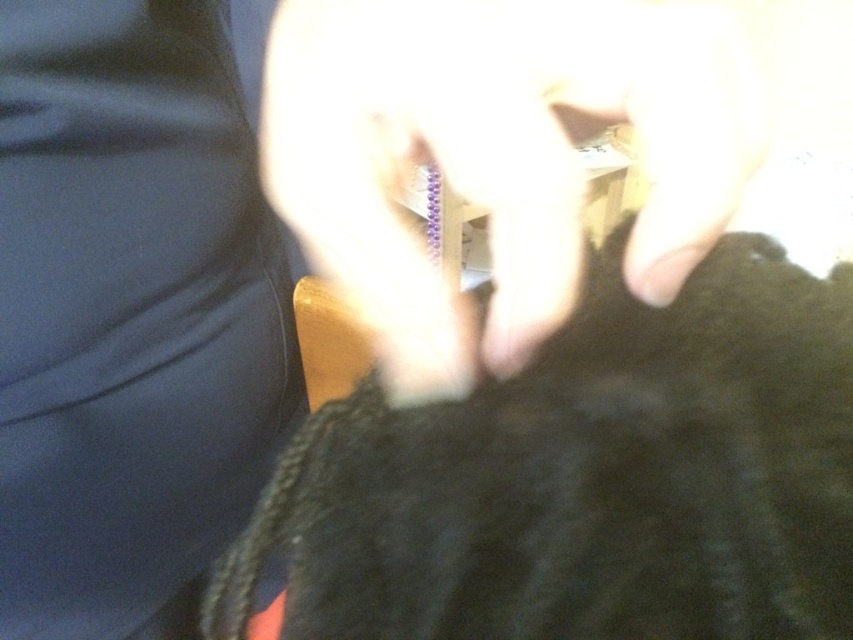
Question: Which point is farther to the camera?

Choices:
 (A) (756, 454)
 (B) (668, 278)

Answer: (B)

Question: Where is black fuzzy fur at center located in relation to smooth skin hand at center in the image?

Choices:
 (A) above
 (B) below

Answer: (B)

Question: Is black fuzzy fur at center to the right of smooth skin hand at center from the viewer's perspective?

Choices:
 (A) yes
 (B) no

Answer: (A)

Question: Can you confirm if black fuzzy fur at center is wider than smooth skin hand at center?

Choices:
 (A) yes
 (B) no

Answer: (A)

Question: Which of the following is the closest to the observer?

Choices:
 (A) black fuzzy fur at center
 (B) smooth skin hand at center

Answer: (A)

Question: Which point is closer to the camera taking this photo?

Choices:
 (A) (403, 579)
 (B) (566, 227)

Answer: (A)